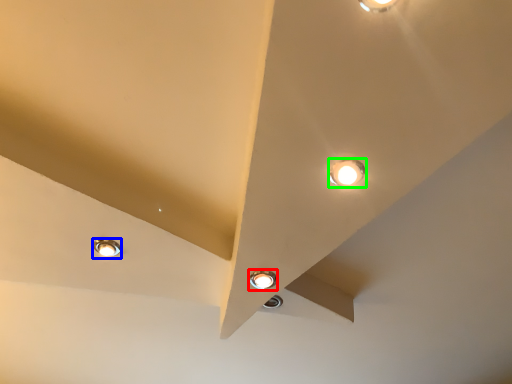
Question: Which is farther away from lamp (highlighted by a red box)? lamp (highlighted by a blue box) or lamp (highlighted by a green box)?

Choices:
 (A) lamp
 (B) lamp

Answer: (A)